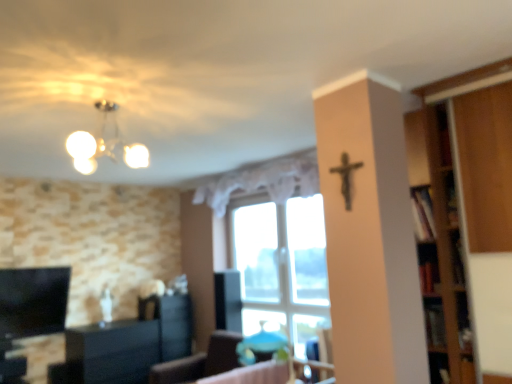
Identify the location of transparent glass window at center. Image resolution: width=512 pixels, height=384 pixels. (281, 265).

In order to face matte white chandelier at upper left, should I rotate leftwards or rightwards?

To face it directly, rotate left by 20.242 degrees.

What do you see at coordinates (439, 368) in the screenshot?
I see `wooden bookshelf at lower right` at bounding box center [439, 368].

Where is `wooden bookshelf at lower right`? This screenshot has width=512, height=384. wooden bookshelf at lower right is located at coordinates (439, 368).

This screenshot has width=512, height=384. I want to click on black glossy cabinet at lower left, so click(112, 352).

Which object is thinner, wooden bookshelf at lower right or black matte crucifix at upper center?

Thinner between the two is black matte crucifix at upper center.

Would you say black matte crucifix at upper center is part of wooden bookshelf at lower right's contents?

No.

Is wooden bookshelf at lower right aimed at black matte crucifix at upper center?

No, wooden bookshelf at lower right is not oriented towards black matte crucifix at upper center.

In the scene shown: In terms of height, does wooden bookshelf at lower right look taller or shorter compared to black matte crucifix at upper center?

Answer: wooden bookshelf at lower right is shorter than black matte crucifix at upper center.

Identify the location of furniture that is behind the wooden bookshelf at lower right. (200, 361).

From a real-world perspective, is matte blue chair at center positioned over wooden bookshelf at lower right based on gravity?

No, from a real-world perspective, matte blue chair at center is not on top of wooden bookshelf at lower right.

Looking at this image, from the image's perspective, which is above, matte blue chair at center or wooden bookshelf at lower right?

wooden bookshelf at lower right, from the image's perspective.

Is white lace curtain at center further to camera compared to transparent glass window at center?

No, it is not.

From a real-world perspective, between white lace curtain at center and transparent glass window at center, who is vertically lower?

transparent glass window at center.

Is white lace curtain at center oriented towards transparent glass window at center?

No, white lace curtain at center is not turned towards transparent glass window at center.

Which is closer, (281, 164) or (277, 236)?

Point (281, 164) is positioned closer to the camera compared to point (277, 236).

Looking at the image, does matte white chandelier at upper left seem bigger or smaller compared to wooden bookshelf at lower right?

matte white chandelier at upper left is bigger than wooden bookshelf at lower right.

Which object is further away from the camera taking this photo, matte white chandelier at upper left or wooden bookshelf at lower right?

wooden bookshelf at lower right.

Does matte white chandelier at upper left touch wooden bookshelf at lower right?

No, matte white chandelier at upper left is not next to wooden bookshelf at lower right.

Is transparent glass window at center touching white lace curtain at center?

transparent glass window at center and white lace curtain at center are not in contact.

Considering the sizes of objects transparent glass window at center and white lace curtain at center in the image provided, who is smaller, transparent glass window at center or white lace curtain at center?

white lace curtain at center.

In the scene shown: Which is more to the right, transparent glass window at center or white lace curtain at center?

transparent glass window at center is more to the right.

Is transparent glass window at center thinner than white lace curtain at center?

Incorrect, the width of transparent glass window at center is not less than that of white lace curtain at center.

Which is behind, point (349, 206) or point (111, 335)?

The point (111, 335) is more distant.

From a real-world perspective, which object stands above the other?

black matte crucifix at upper center.

How much distance is there between black matte crucifix at upper center and black glossy cabinet at lower left?

black matte crucifix at upper center and black glossy cabinet at lower left are 12.46 feet apart.

Is black matte crucifix at upper center to the left or to the right of black glossy cabinet at lower left in the image?

black matte crucifix at upper center is to the right of black glossy cabinet at lower left.

Is black glossy cabinet at lower left oriented towards wooden bookshelf at lower right?

Yes, black glossy cabinet at lower left faces towards wooden bookshelf at lower right.

Who is taller, black glossy cabinet at lower left or wooden bookshelf at lower right?

black glossy cabinet at lower left.

Between black glossy cabinet at lower left and wooden bookshelf at lower right, which one has larger width?

black glossy cabinet at lower left.

The width and height of the screenshot is (512, 384). Identify the location of shelf that is on the right side of black matte crucifix at upper center. (439, 368).

Identify the location of furniture behind the wooden bookshelf at lower right. (200, 361).

When comparing their distances from transparent glass window at center, does wooden bookshelf at lower right or black matte crucifix at upper center seem closer?

wooden bookshelf at lower right is positioned closer to the anchor transparent glass window at center.

From the image, which object appears to be farther from white lace curtain at center, black glossy cabinet at lower left or wooden bookshelf at lower right?

black glossy cabinet at lower left lies further to white lace curtain at center than the other object.

Based on the photo, looking at the image, which one is located further to wooden bookshelf at lower right, black matte crucifix at upper center or black glossy cabinet at lower left?

Among the two, black glossy cabinet at lower left is located further to wooden bookshelf at lower right.

When comparing their distances from wooden bookshelf at lower right, does white lace curtain at center or transparent glass window at center seem closer?

transparent glass window at center is positioned closer to the anchor wooden bookshelf at lower right.

When comparing their distances from matte white chandelier at upper left, does white lace curtain at center or wooden bookshelf at lower right seem closer?

The object closer to matte white chandelier at upper left is white lace curtain at center.

Based on their spatial positions, is black matte crucifix at upper center or transparent glass window at center closer to black glossy cabinet at lower left?

Based on the image, transparent glass window at center appears to be nearer to black glossy cabinet at lower left.

From the image, which object appears to be nearer to matte blue chair at center, transparent glass window at center or black glossy cabinet at lower left?

Among the two, transparent glass window at center is located nearer to matte blue chair at center.

Based on the photo, from the image, which object appears to be nearer to matte blue chair at center, black matte crucifix at upper center or white lace curtain at center?

The object closer to matte blue chair at center is white lace curtain at center.

Locate an element on the screen. This screenshot has width=512, height=384. furniture between black matte crucifix at upper center and transparent glass window at center in the front-back direction is located at coordinates (200, 361).

The height and width of the screenshot is (384, 512). I want to click on furniture between matte white chandelier at upper left and black glossy cabinet at lower left from top to bottom, so click(x=200, y=361).

You are a GUI agent. You are given a task and a screenshot of the screen. Output one action in this format:
    pyautogui.click(x=<x>, y=<y>)
    Task: Click on the curtain positioned between wooden bookshelf at lower right and transparent glass window at center from near to far
    The height and width of the screenshot is (384, 512).
    Given the screenshot: What is the action you would take?
    pyautogui.click(x=263, y=181)

At what (x,y) coordinates should I click in order to perform the action: click on furniture between black glossy cabinet at lower left and transparent glass window at center from left to right. Please return your answer as a coordinate pair (x, y). This screenshot has height=384, width=512. Looking at the image, I should click on (200, 361).